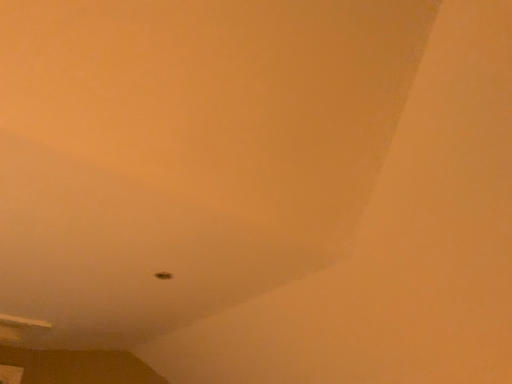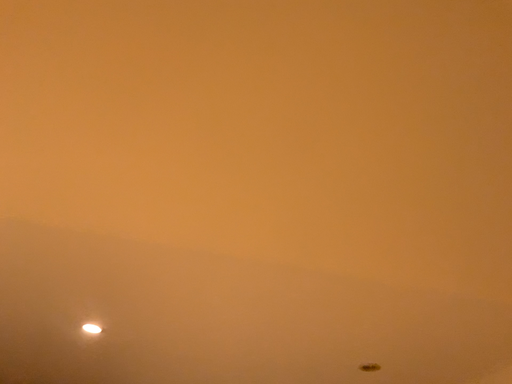
Question: Which way did the camera rotate in the video?

Choices:
 (A) rotated downward
 (B) rotated upward

Answer: (B)